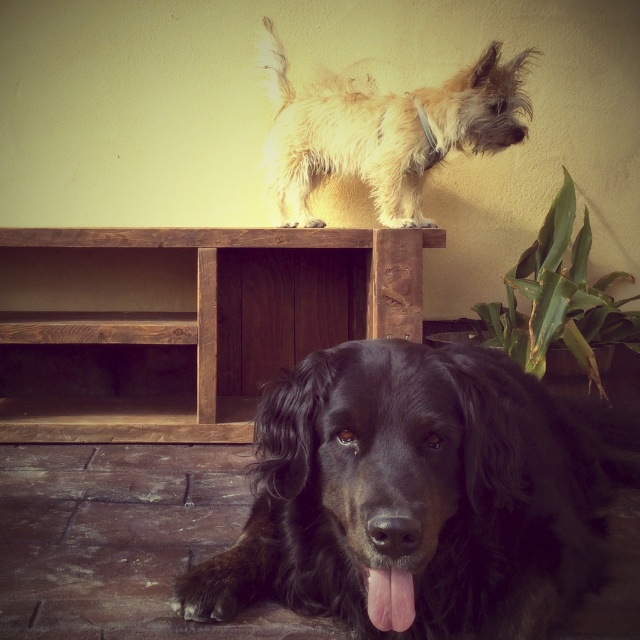
Can you confirm if black fur dog at lower center is positioned to the right of fuzzy beige dog at upper center?

Correct, you'll find black fur dog at lower center to the right of fuzzy beige dog at upper center.

Measure the distance between black fur dog at lower center and camera.

The distance of black fur dog at lower center from camera is 38.88 inches.

Locate an element on the screen. black fur dog at lower center is located at coordinates (417, 497).

You are a GUI agent. You are given a task and a screenshot of the screen. Output one action in this format:
    pyautogui.click(x=<x>, y=<y>)
    Task: Click on the black fur dog at lower center
    
    Given the screenshot: What is the action you would take?
    pyautogui.click(x=417, y=497)